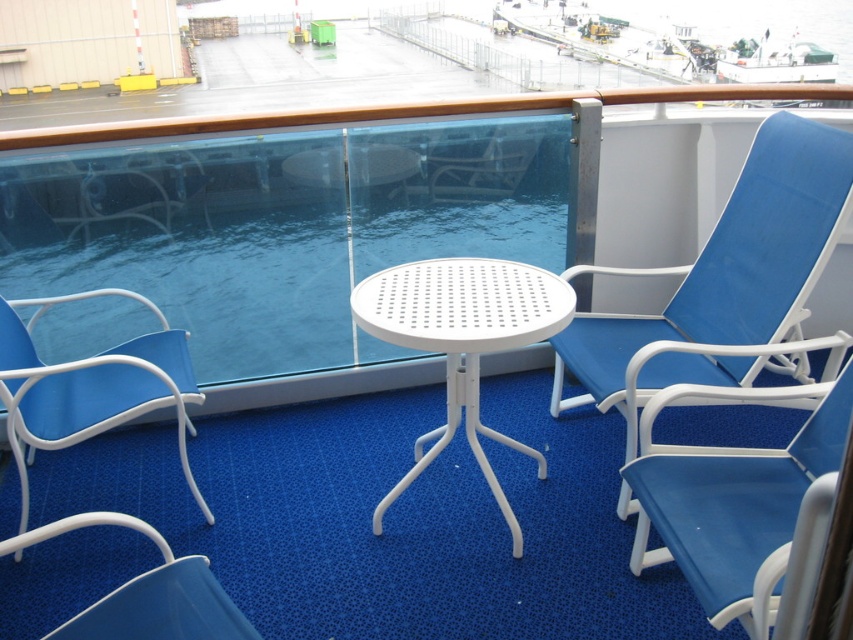
From the picture: Can you confirm if blue fabric beach chair at lower right is shorter than matte blue beach chair at lower left?

No, blue fabric beach chair at lower right is not shorter than matte blue beach chair at lower left.

Where is `blue fabric beach chair at lower right`? This screenshot has width=853, height=640. blue fabric beach chair at lower right is located at coordinates (734, 500).

Measure the distance between point (x=473, y=316) and camera.

6.51 feet

You are a GUI agent. You are given a task and a screenshot of the screen. Output one action in this format:
    pyautogui.click(x=<x>, y=<y>)
    Task: Click on the white plastic table at center
    
    Given the screenshot: What is the action you would take?
    pyautogui.click(x=462, y=342)

Identify the location of white plastic table at center. The width and height of the screenshot is (853, 640). (462, 342).

Where is `blue fabric beach chair at right`? The height and width of the screenshot is (640, 853). blue fabric beach chair at right is located at coordinates (722, 282).

Between blue fabric beach chair at right and matte white beach chair at lower left, which one appears on the right side from the viewer's perspective?

blue fabric beach chair at right is more to the right.

Where is `blue fabric beach chair at right`? blue fabric beach chair at right is located at coordinates (722, 282).